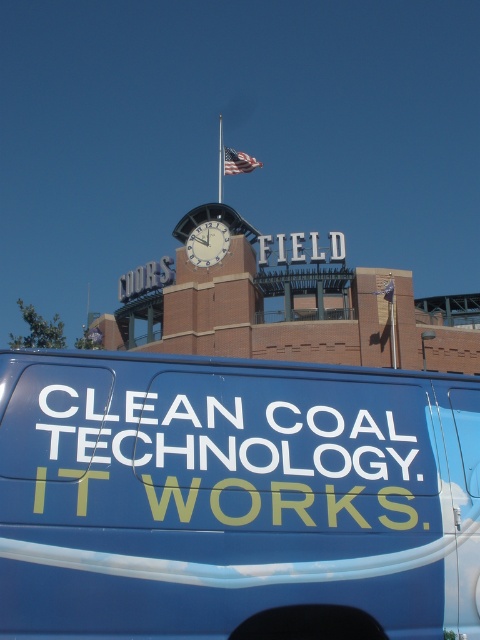
Which is more to the left, blue matte van at lower center or white glossy clock at center?

white glossy clock at center is more to the left.

Is blue matte van at lower center taller than white glossy clock at center?

No.

Measure the distance between blue matte van at lower center and camera.

blue matte van at lower center and camera are 4.47 meters apart.

What are the coordinates of `blue matte van at lower center` in the screenshot? It's located at (236, 497).

Is whitematerial/textureclean coal technology it works at upper center behind white glossy clock at center?

No.

Who is positioned more to the right, whitematerial/textureclean coal technology it works at upper center or white glossy clock at center?

whitematerial/textureclean coal technology it works at upper center is more to the right.

Is point (315, 440) positioned behind point (215, 227)?

No, it is in front of (215, 227).

Locate a point on the whitematerial/textureclean coal technology it works at upper center. Your answer should be formatted as a tuple, i.e. [(x, y)], where the tuple contains the x and y coordinates of a point satisfying the conditions above.

[(243, 451)]

Is the position of blue matte van at lower center more distant than that of whitematerial/textureclean coal technology it works at upper center?

No.

What do you see at coordinates (236, 497) in the screenshot? Image resolution: width=480 pixels, height=640 pixels. I see `blue matte van at lower center` at bounding box center [236, 497].

Is point (433, 600) more distant than point (409, 525)?

That is False.

The image size is (480, 640). In order to click on blue matte van at lower center in this screenshot , I will do `click(236, 497)`.